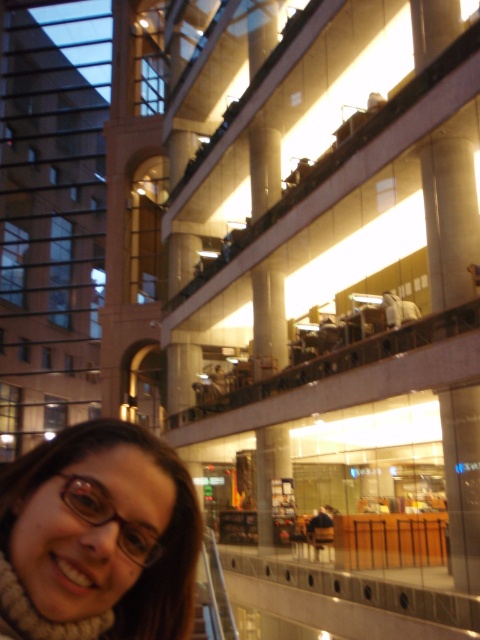
Question: Is beige knitted scarf at lower left smaller than translucent plastic glasses at lower left?

Choices:
 (A) no
 (B) yes

Answer: (A)

Question: Which point is closer to the camera taking this photo?

Choices:
 (A) pyautogui.click(x=85, y=497)
 (B) pyautogui.click(x=101, y=524)

Answer: (B)

Question: Is beige knitted scarf at lower left behind translucent plastic glasses at lower left?

Choices:
 (A) yes
 (B) no

Answer: (B)

Question: Observing the image, what is the correct spatial positioning of beige knitted scarf at lower left in reference to translucent plastic glasses at lower left?

Choices:
 (A) left
 (B) right

Answer: (A)

Question: Which point appears farthest from the camera in this image?

Choices:
 (A) (139, 534)
 (B) (39, 618)

Answer: (A)